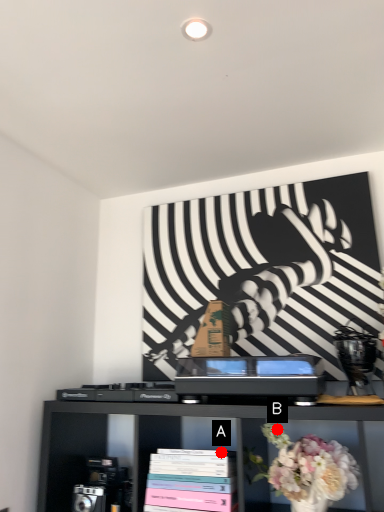
Question: Two points are circled on the image, labeled by A and B beside each circle. Which point is closer to the camera?

Choices:
 (A) A is closer
 (B) B is closer

Answer: (A)